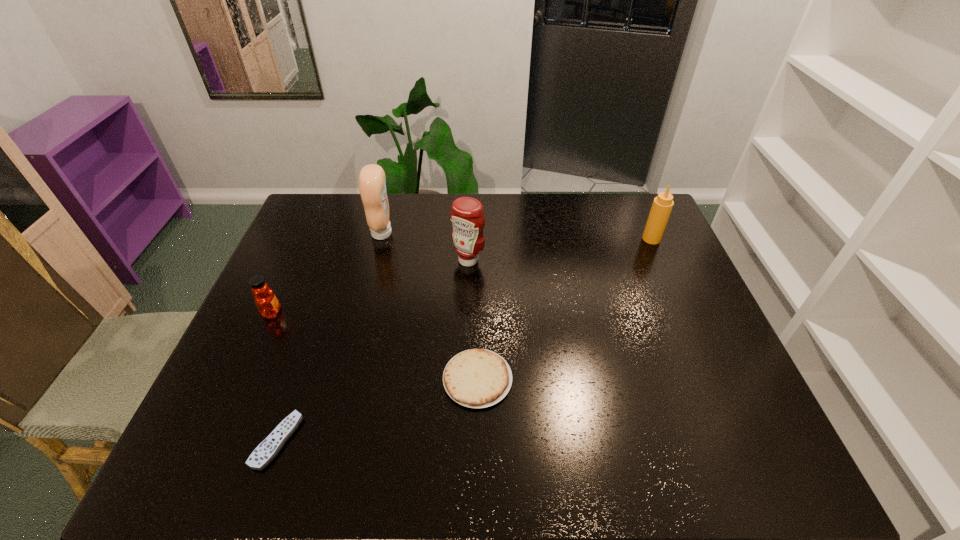
What are the coordinates of `object that is positioned at the near left corner` in the screenshot? It's located at (266, 451).

The image size is (960, 540). In order to click on object that is positioned at the far right corner in this screenshot , I will do `click(662, 205)`.

Where is `vacant space at the far edge of the desktop`? vacant space at the far edge of the desktop is located at coordinates (548, 232).

The image size is (960, 540). Identify the location of vacant region at the left edge. (284, 335).

The width and height of the screenshot is (960, 540). In the image, there is a desktop. What are the coordinates of `vacant space at the right edge` in the screenshot? It's located at (684, 385).

Where is `vacant space at the far right corner of the desktop`? Image resolution: width=960 pixels, height=540 pixels. vacant space at the far right corner of the desktop is located at coordinates (618, 217).

Where is `free space between the nearest condiment and the second shortest object`? free space between the nearest condiment and the second shortest object is located at coordinates (473, 320).

In order to click on vacant area that lies between the third shortest object and the leftmost condiment in this screenshot , I will do `click(327, 273)`.

You are a GUI agent. You are given a task and a screenshot of the screen. Output one action in this format:
    pyautogui.click(x=<x>, y=<y>)
    Task: Click on the free space that is in between the tortilla and the nearest condiment
    
    Given the screenshot: What is the action you would take?
    pyautogui.click(x=473, y=320)

Locate an element on the screen. free spot between the rightmost condiment and the leftmost condiment is located at coordinates (516, 236).